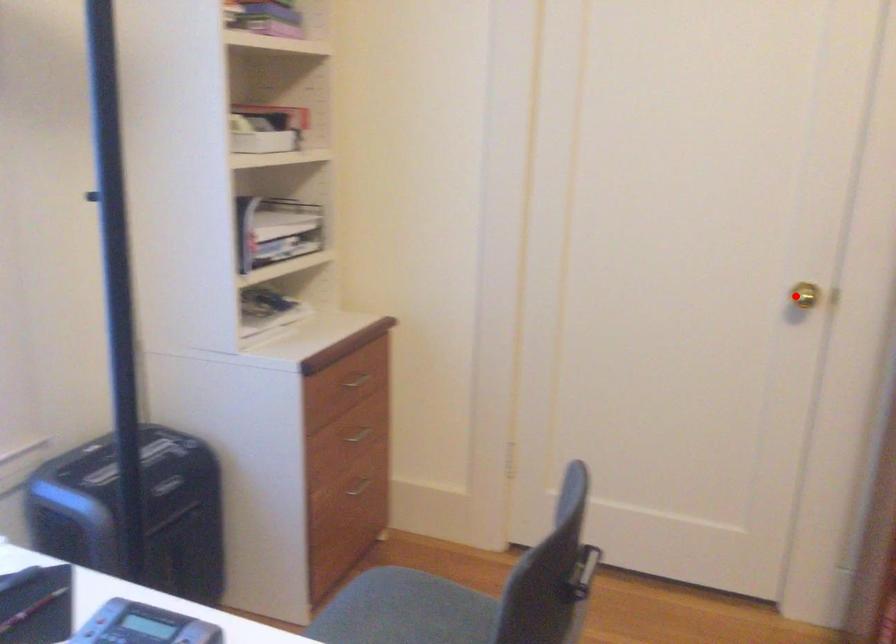
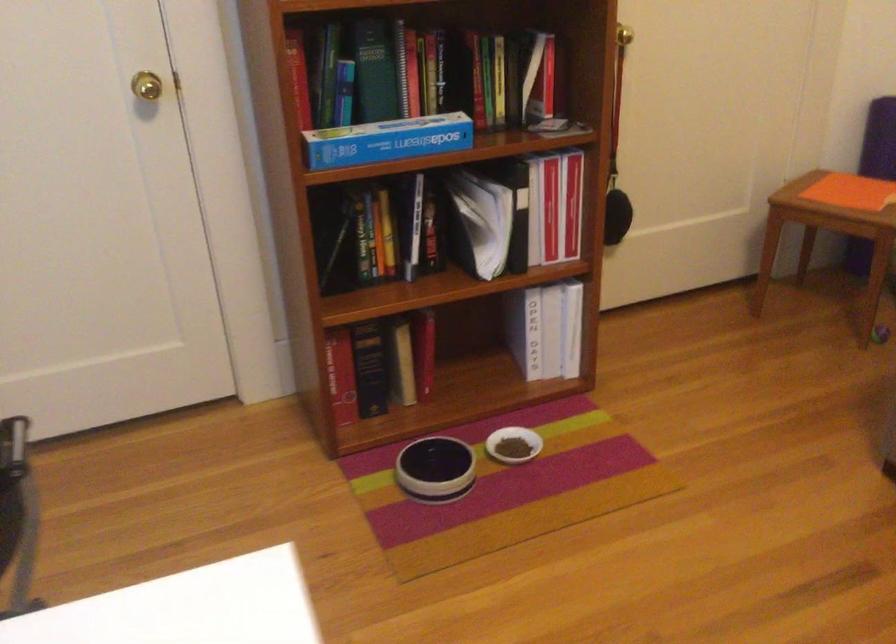
Question: A red point is marked in image1. In image2, is the corresponding 3D point closer to the camera or farther? Reply with the corresponding letter.

Choices:
 (A) The corresponding 3D point is closer.
 (B) The corresponding 3D point is farther.

Answer: (A)